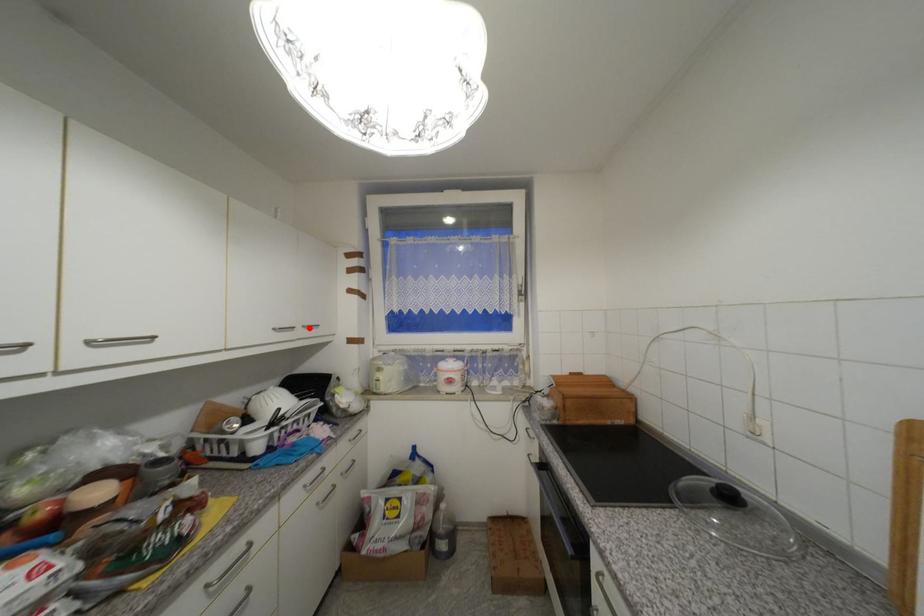
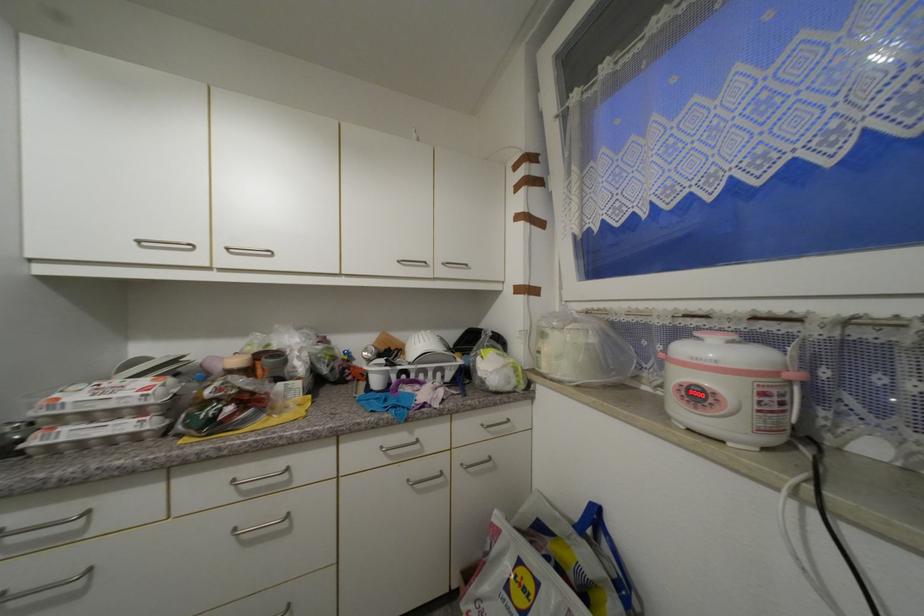
The point at the highlighted location is marked in the first image. Where is the corresponding point in the second image?

(448, 265)